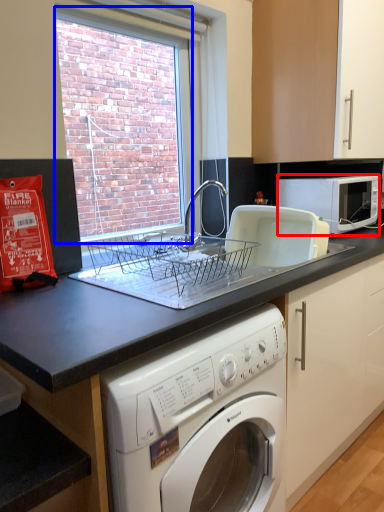
Question: Which object appears farthest to the camera in this image, microwave oven (highlighted by a red box) or window screen (highlighted by a blue box)?

Choices:
 (A) microwave oven
 (B) window screen

Answer: (A)